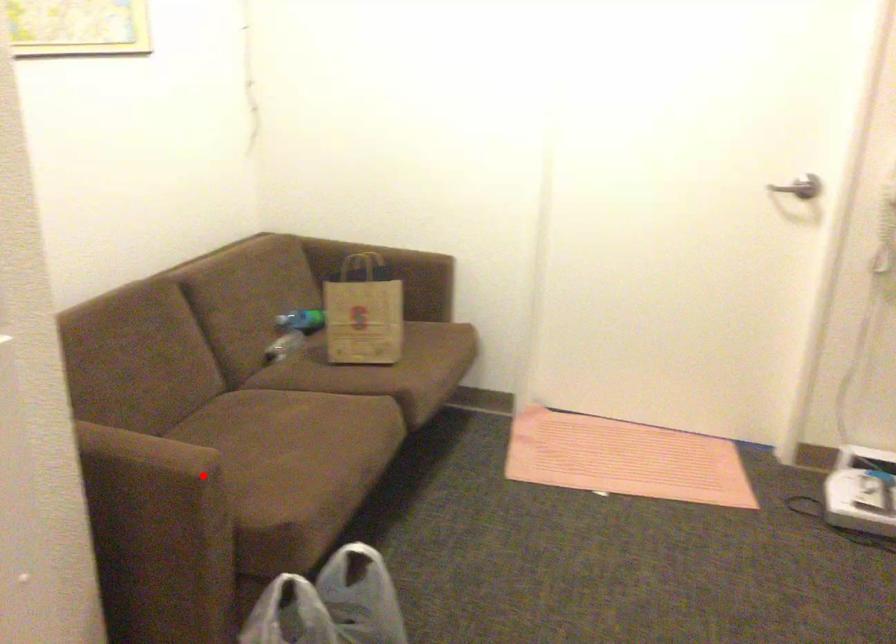
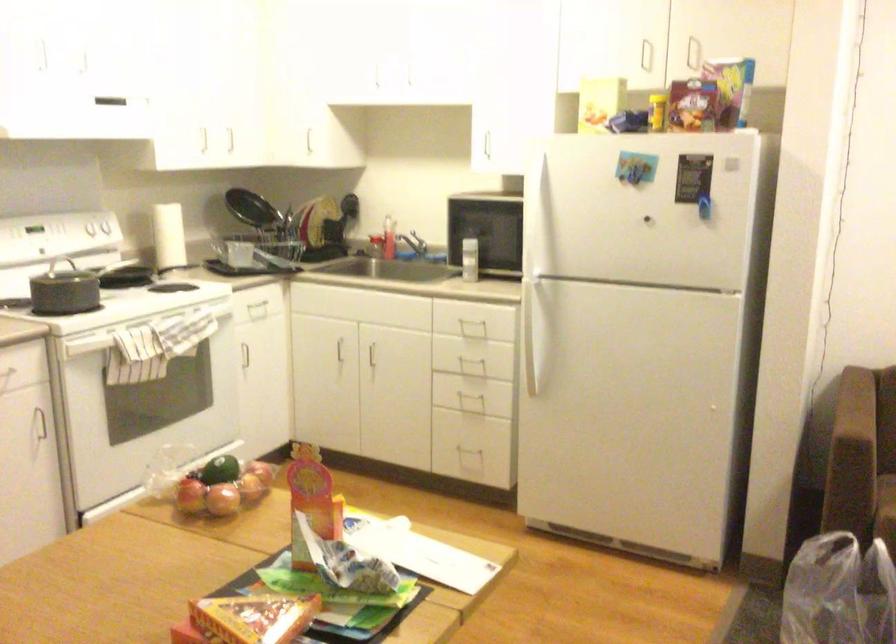
The point at the highlighted location is marked in the first image. Where is the corresponding point in the second image?

(879, 446)